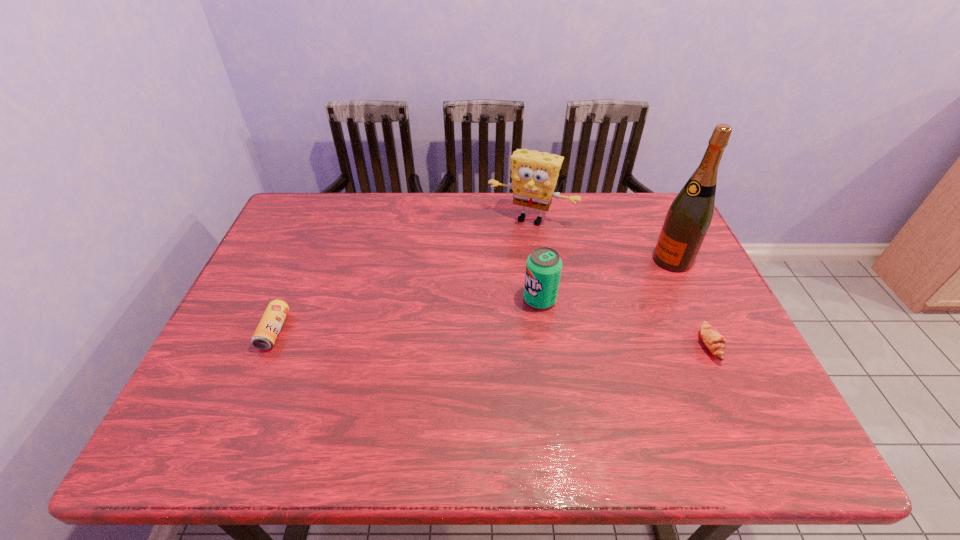
At what (x,y) coordinates should I click in order to perform the action: click on pastry located at the right edge. Please return your answer as a coordinate pair (x, y). The height and width of the screenshot is (540, 960). Looking at the image, I should click on (713, 340).

Identify the location of wine bottle that is at the right edge. This screenshot has height=540, width=960. (688, 219).

I want to click on vacant region at the far edge of the desktop, so click(592, 221).

Image resolution: width=960 pixels, height=540 pixels. In the image, there is a desktop. Identify the location of vacant space at the near edge. point(683,398).

The height and width of the screenshot is (540, 960). In the image, there is a desktop. Identify the location of free space at the left edge. (274, 245).

The width and height of the screenshot is (960, 540). I want to click on vacant region at the right edge of the desktop, so click(651, 245).

Where is `free space at the far left corner of the desktop`? free space at the far left corner of the desktop is located at coordinates (330, 193).

Image resolution: width=960 pixels, height=540 pixels. What are the coordinates of `free point between the shortest object and the farthest object` in the screenshot? It's located at (620, 282).

This screenshot has width=960, height=540. Identify the location of vacant space that is in between the leftmost object and the pastry. (492, 338).

At what (x,y) coordinates should I click in order to perform the action: click on free point between the tallest object and the shortest object. Please return your answer as a coordinate pair (x, y). Looking at the image, I should click on (691, 302).